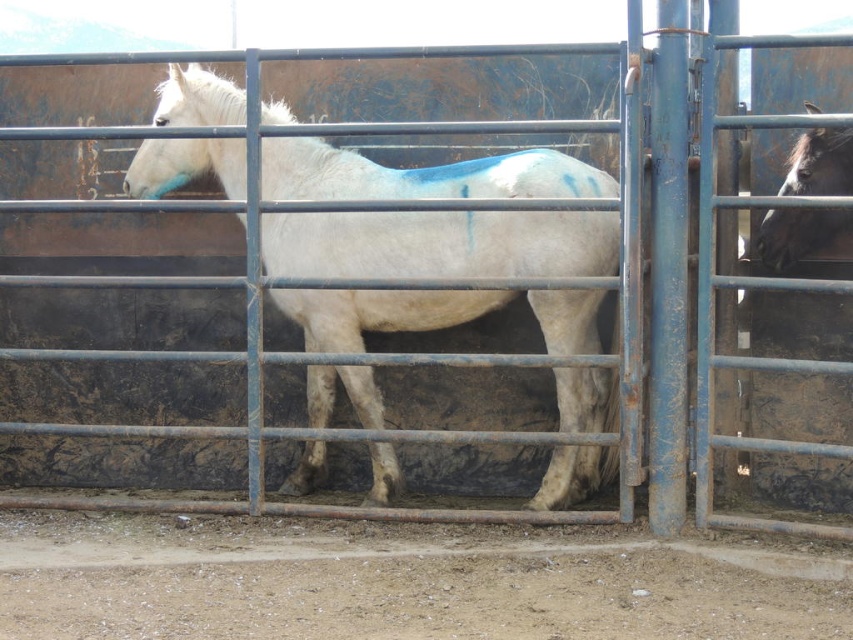
Does white matte horse at center have a greater width compared to black glossy horse at right?

Indeed, white matte horse at center has a greater width compared to black glossy horse at right.

I want to click on white matte horse at center, so click(440, 243).